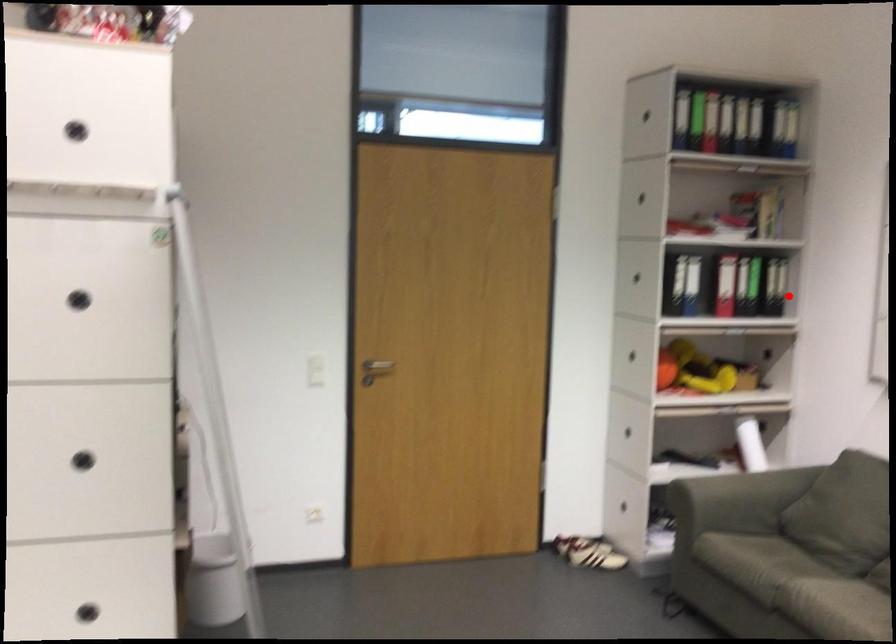
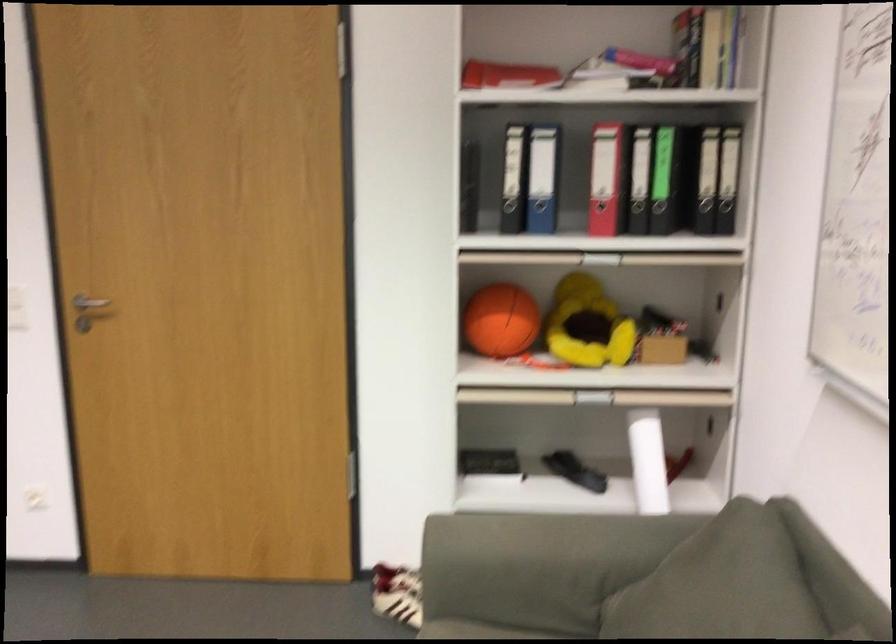
Question: I am providing you with two images of the same scene from different viewpoints. Given a red point in image1, look at the same physical point in image2. Is it:

Choices:
 (A) Closer to the viewpoint
 (B) Farther from the viewpoint

Answer: (A)